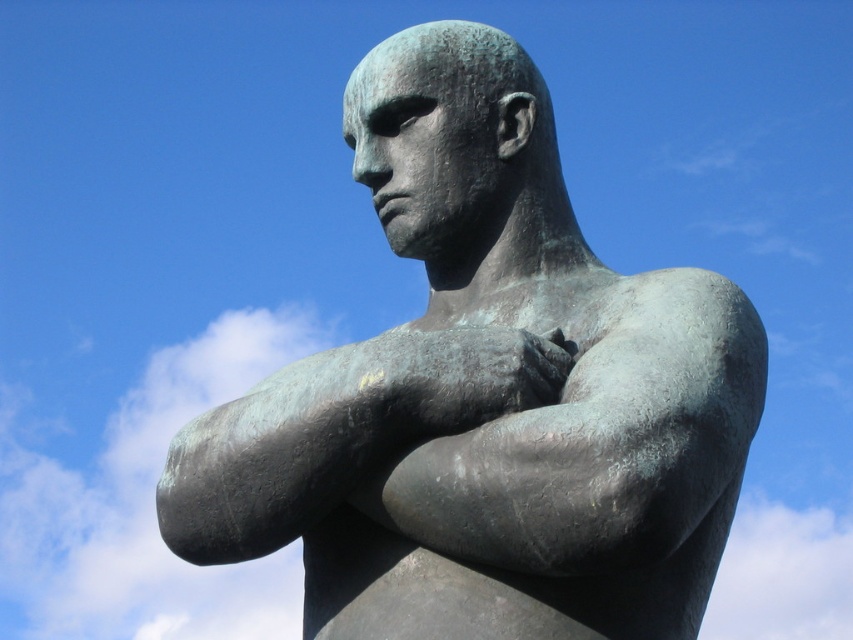
Question: Does green patina bronze statue at center have a lesser width compared to bronze textured arm at center?

Choices:
 (A) yes
 (B) no

Answer: (B)

Question: Observing the image, what is the correct spatial positioning of green patina bronze statue at center in reference to bronze textured arm at center?

Choices:
 (A) below
 (B) above

Answer: (B)

Question: Can you confirm if green patina bronze statue at center is smaller than bronze textured arm at center?

Choices:
 (A) no
 (B) yes

Answer: (A)

Question: Which object appears closest to the camera in this image?

Choices:
 (A) green patina bronze statue at center
 (B) bronze textured arm at center

Answer: (A)